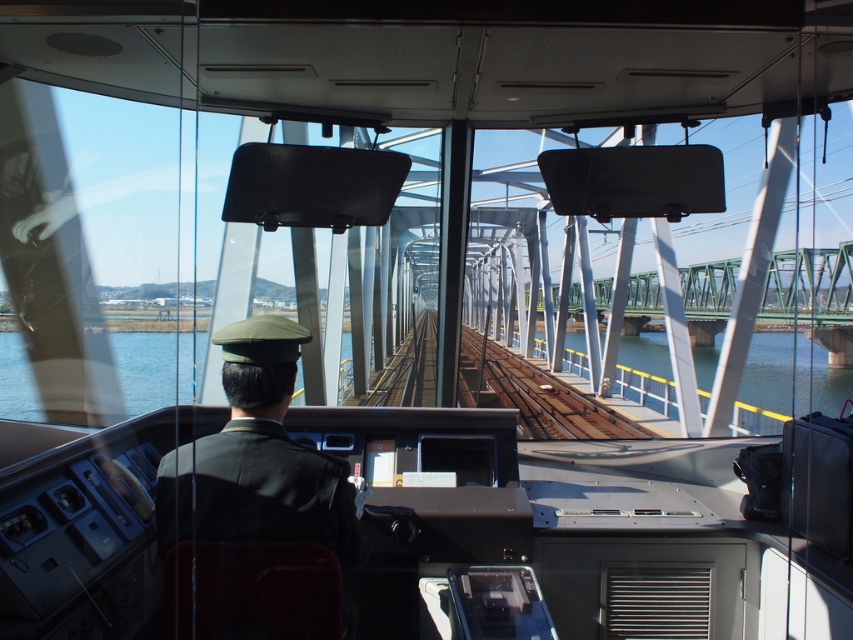
You are a train engineer observing the tracks ahead. You notice the green metallic bridge at center and the clear blue water at track right. Which object occupies a larger portion of your view from the driver cabin?

The green metallic bridge at center occupies a larger portion of the view from the driver cabin than the clear blue water at track right, as it is described as bigger.

You are a passenger on the train and want to know if the train is currently crossing over water. Based on the scene, can you determine if the brown wooden train track at center is above or below the blue water at center?

The brown wooden train track at center is located above the blue water at center, so the train is currently crossing over water.